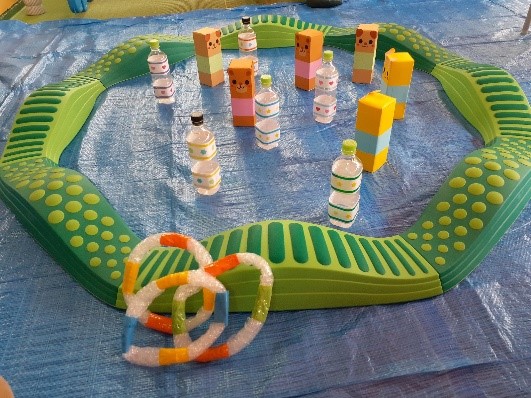
Where is `bottle`? This screenshot has height=398, width=531. bottle is located at coordinates (198, 142), (352, 187), (327, 96), (266, 105), (245, 36), (152, 65).